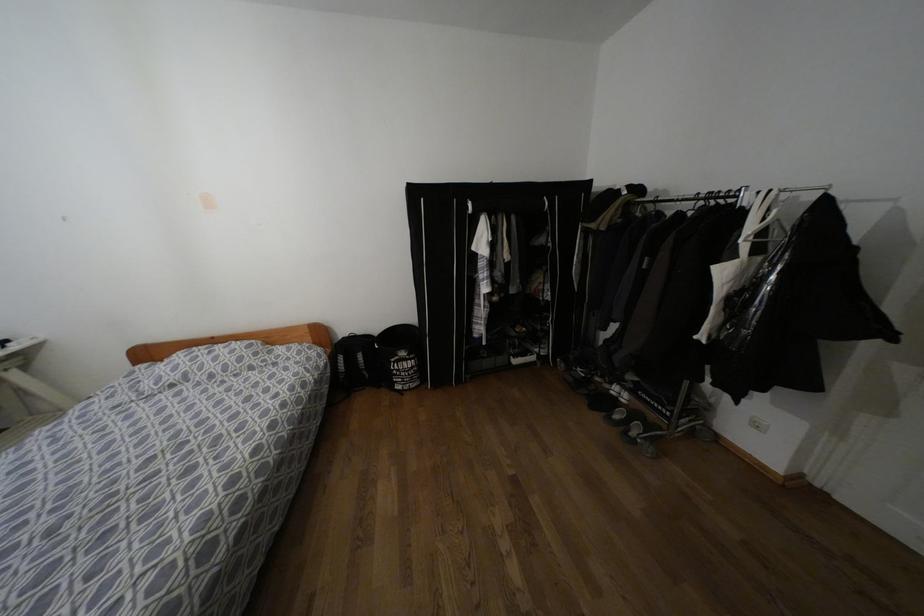
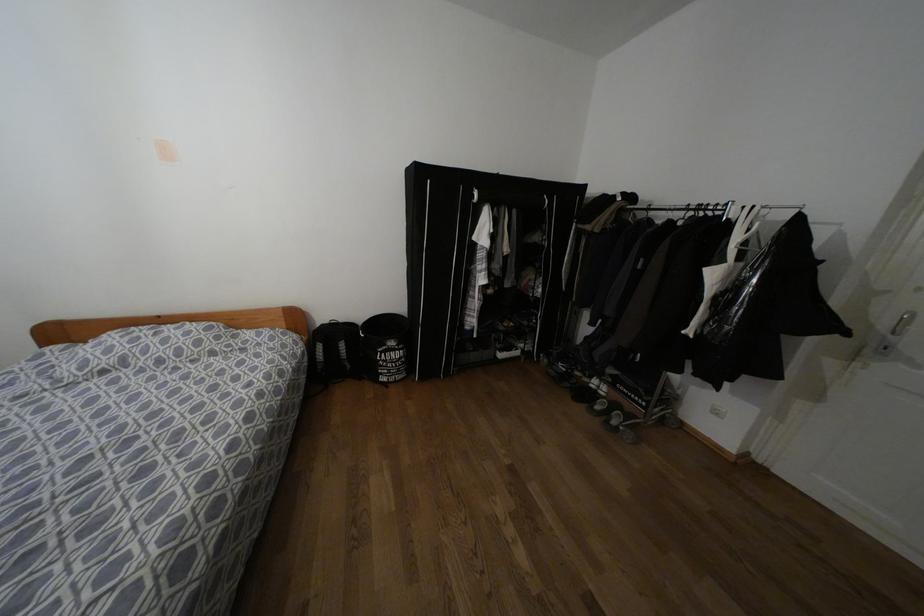
Find the pixel in the second image that matches pixel 468 204 in the first image.

(475, 192)